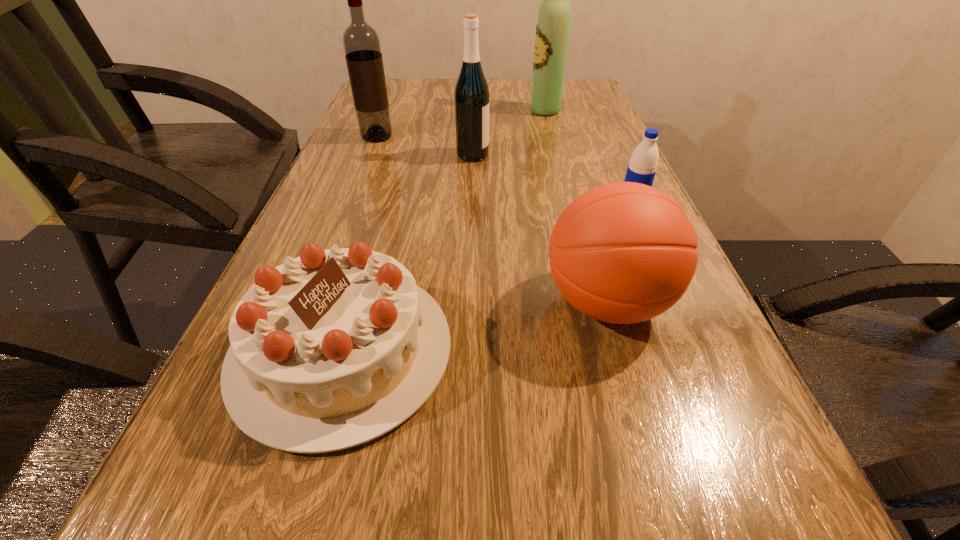
Where is `free point located on the front-facing side of the farthest object`? This screenshot has height=540, width=960. free point located on the front-facing side of the farthest object is located at coordinates (504, 111).

Find the location of a particular element. free space located on the front-facing side of the farthest object is located at coordinates (428, 111).

Find the location of a particular element. The width and height of the screenshot is (960, 540). vacant region located 0.070m on the back of the leftmost wine bottle is located at coordinates (383, 119).

You are a GUI agent. You are given a task and a screenshot of the screen. Output one action in this format:
    pyautogui.click(x=<x>, y=<y>)
    Task: Click on the vacant point located 0.080m on the label of the shortest wine bottle
    The height and width of the screenshot is (540, 960).
    Given the screenshot: What is the action you would take?
    pyautogui.click(x=519, y=155)

What are the coordinates of `vacant position located on the back of the third shortest object` in the screenshot? It's located at (584, 223).

Find the location of `free space located on the back of the third nearest object`. free space located on the back of the third nearest object is located at coordinates [x=600, y=132].

Where is `free region located 0.260m on the back of the birthday cake`? Image resolution: width=960 pixels, height=540 pixels. free region located 0.260m on the back of the birthday cake is located at coordinates (385, 198).

The image size is (960, 540). I want to click on object at the far edge, so click(553, 25).

Where is `wine bottle that is at the left edge`? The width and height of the screenshot is (960, 540). wine bottle that is at the left edge is located at coordinates (361, 43).

Where is `birthday cake present at the left edge`? The width and height of the screenshot is (960, 540). birthday cake present at the left edge is located at coordinates (332, 349).